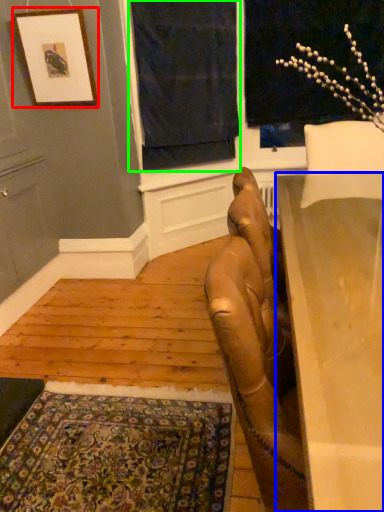
Question: Estimate the real-world distances between objects in this image. Which object is closer to picture frame (highlighted by a red box), table (highlighted by a blue box) or curtain (highlighted by a green box)?

Choices:
 (A) table
 (B) curtain

Answer: (B)